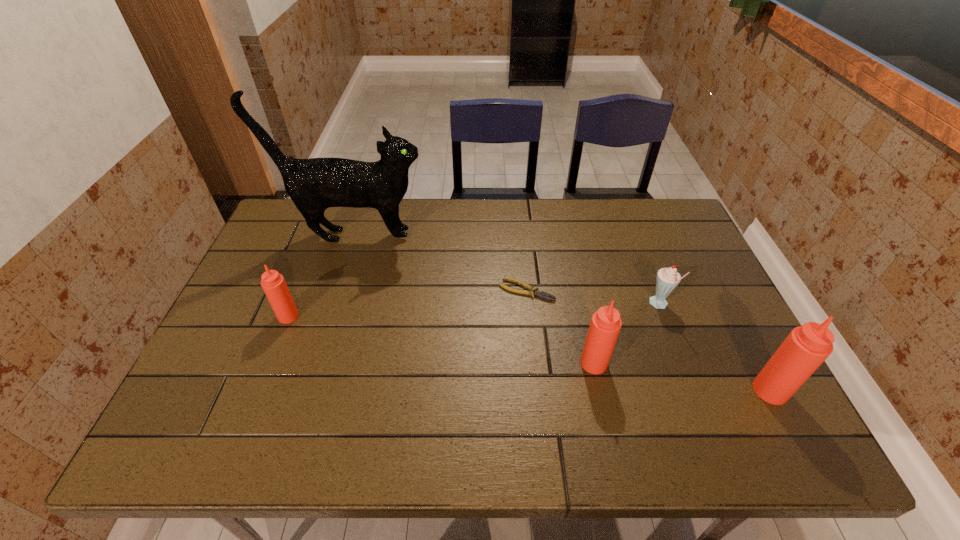
Where is `object at the far edge`? Image resolution: width=960 pixels, height=540 pixels. object at the far edge is located at coordinates (315, 184).

You are a GUI agent. You are given a task and a screenshot of the screen. Output one action in this format:
    pyautogui.click(x=<x>, y=<y>)
    Task: Click on the object present at the near edge
    This screenshot has width=960, height=540.
    Given the screenshot: What is the action you would take?
    pyautogui.click(x=806, y=347)

In order to click on Tabasco sauce positioned at the left edge in this screenshot , I will do `click(274, 285)`.

Identify the location of cat at the left edge. This screenshot has height=540, width=960. (315, 184).

The height and width of the screenshot is (540, 960). I want to click on Tabasco sauce that is at the right edge, so click(806, 347).

This screenshot has width=960, height=540. I want to click on milkshake that is at the right edge, so 667,279.

Locate an element on the screen. The image size is (960, 540). object located in the far left corner section of the desktop is located at coordinates (315, 184).

This screenshot has height=540, width=960. In order to click on object at the near right corner in this screenshot , I will do `click(806, 347)`.

The width and height of the screenshot is (960, 540). Find the location of `blank area at the far edge`. blank area at the far edge is located at coordinates (446, 225).

In the image, there is a desktop. Where is `vacant area at the near edge`? vacant area at the near edge is located at coordinates (266, 393).